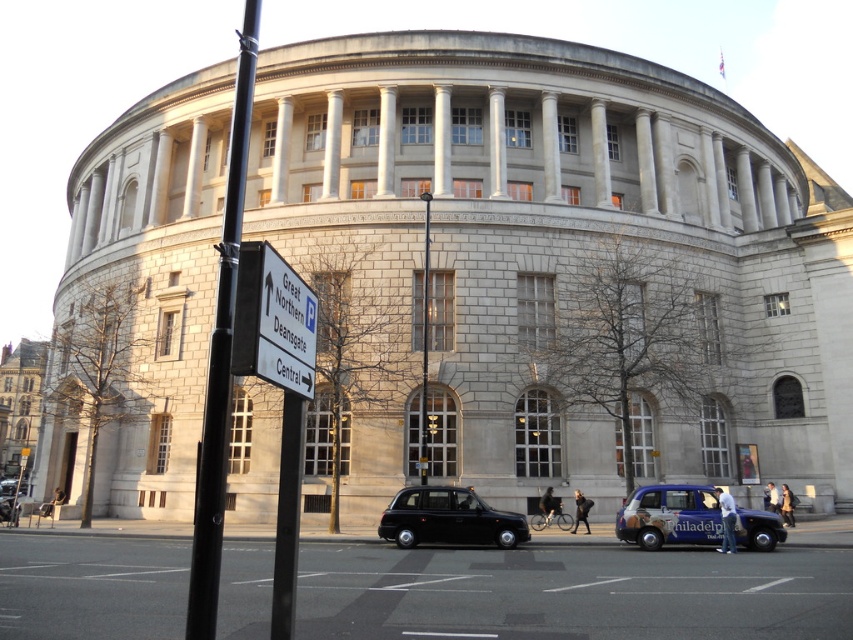
You are a pedestrian standing on the sidewalk in front of the classical building. You want to cross the street to reach the shiny black taxi at center. However, there is a black metal pole at center in your path. Can you walk around the pole to reach the taxi?

The black metal pole at center is in front of the shiny black taxi at center, so you can walk around the pole to reach the taxi since it is blocking the direct path but not the entire area.

You are a delivery person trying to park your delivery van that is 2 meters wide. You see the black metal pole at center and the blue metallic taxi at lower center. Can you park your van between them without hitting either?

The black metal pole at center might be wider than the blue metallic taxi at lower center, so the space between them may not be sufficient for a 2 meter wide van. You should check the exact width before attempting to park.